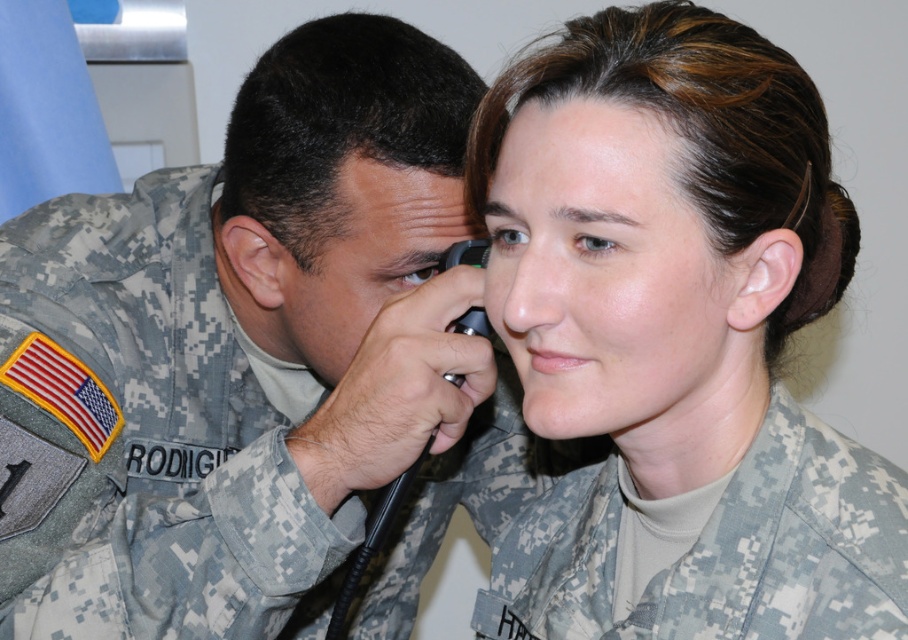
Is smooth skin at center thinner than matte skin forehead at upper center?

No, smooth skin at center is not thinner than matte skin forehead at upper center.

Who is higher up, smooth skin at center or matte skin forehead at upper center?

smooth skin at center is higher up.

Measure the distance between point (481, 186) and camera.

Point (481, 186) is 70.22 centimeters from camera.

Find the location of a particular element. smooth skin at center is located at coordinates (581, 163).

Between camouflage fabric uniform at center and smooth skin at center, which one is positioned higher?

Positioned higher is smooth skin at center.

Consider the image. Does camouflage fabric uniform at center appear under smooth skin at center?

Indeed, camouflage fabric uniform at center is positioned under smooth skin at center.

Is point (771, 461) less distant than point (569, 116)?

No, (771, 461) is behind (569, 116).

What are the coordinates of `camouflage fabric uniform at center` in the screenshot? It's located at tap(706, 545).

Which is more to the left, camouflage uniform at left or matte skin forehead at upper center?

camouflage uniform at left is more to the left.

Which is behind, point (18, 218) or point (385, 177)?

Point (18, 218)

Does point (460, 144) come behind point (354, 179)?

Yes, it is behind point (354, 179).

Find the location of a particular element. The height and width of the screenshot is (640, 908). camouflage uniform at left is located at coordinates (243, 369).